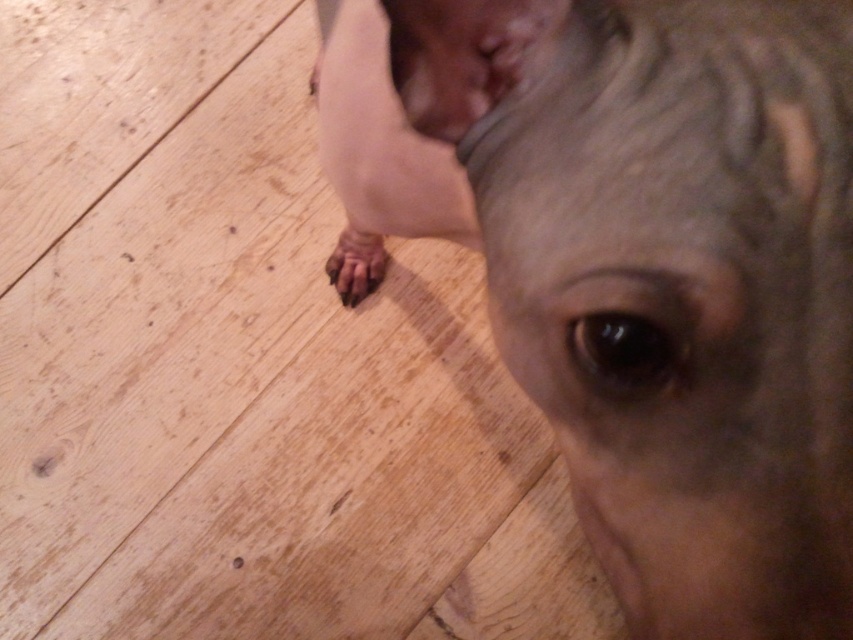
Question: Is gray matte dog at center smaller than brown rough fur at lower center?

Choices:
 (A) yes
 (B) no

Answer: (B)

Question: Does gray matte dog at center have a smaller size compared to brown rough fur at lower center?

Choices:
 (A) yes
 (B) no

Answer: (B)

Question: Does gray matte dog at center have a smaller size compared to brown rough fur at lower center?

Choices:
 (A) no
 (B) yes

Answer: (A)

Question: Which point is farther from the camera taking this photo?

Choices:
 (A) (772, 301)
 (B) (352, 236)

Answer: (B)

Question: Among these points, which one is farthest from the camera?

Choices:
 (A) pyautogui.click(x=718, y=19)
 (B) pyautogui.click(x=335, y=285)

Answer: (B)

Question: Which object appears farthest from the camera in this image?

Choices:
 (A) brown rough fur at lower center
 (B) gray matte dog at center

Answer: (A)